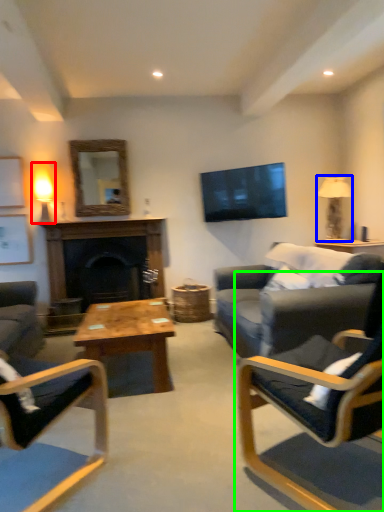
Question: Which object is positioned closest to lamp (highlighted by a red box)? Select from lamp (highlighted by a blue box) and chair (highlighted by a green box).

Choices:
 (A) lamp
 (B) chair

Answer: (A)